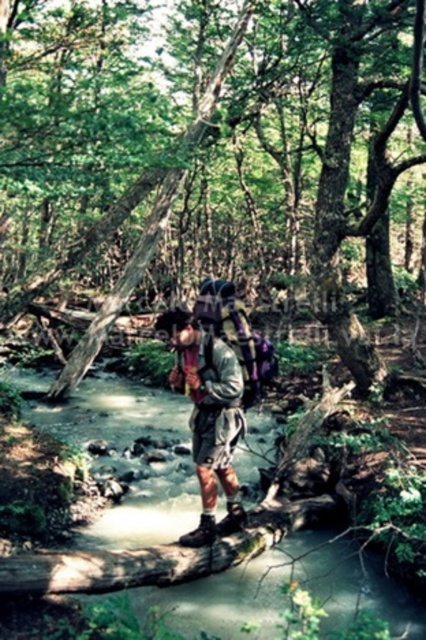
Question: Estimate the real-world distances between objects in this image. Which object is closer to the rough bark tree at center?

Choices:
 (A) camouflage fabric backpack at center
 (B) clear water at stream center

Answer: (B)

Question: Can you confirm if rough bark tree at center is positioned to the right of camouflage fabric backpack at center?

Choices:
 (A) no
 (B) yes

Answer: (B)

Question: Estimate the real-world distances between objects in this image. Which object is closer to the clear water at stream center?

Choices:
 (A) camouflage fabric backpack at center
 (B) rough bark tree at center

Answer: (A)

Question: Which object is positioned farthest from the clear water at stream center?

Choices:
 (A) camouflage fabric backpack at center
 (B) rough bark tree at center

Answer: (B)

Question: From the image, what is the correct spatial relationship of clear water at stream center in relation to camouflage fabric backpack at center?

Choices:
 (A) left
 (B) right

Answer: (A)

Question: Does rough bark tree at center lie in front of camouflage fabric backpack at center?

Choices:
 (A) no
 (B) yes

Answer: (B)